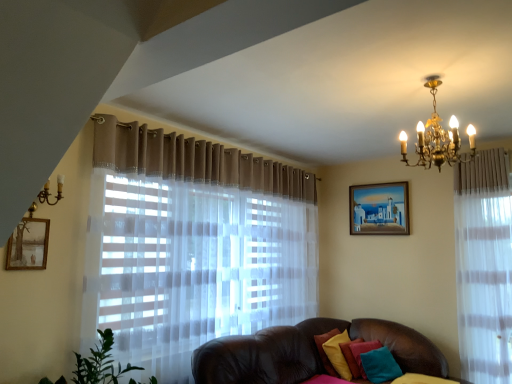
Looking at this image, what is the approximate width of sheer white curtain at left?

sheer white curtain at left is 30.31 inches wide.

Where is `sheer white curtain at left`? Image resolution: width=512 pixels, height=384 pixels. sheer white curtain at left is located at coordinates (192, 245).

The width and height of the screenshot is (512, 384). What do you see at coordinates (192, 245) in the screenshot?
I see `sheer white curtain at left` at bounding box center [192, 245].

The image size is (512, 384). In order to click on sheer white curtain at left in this screenshot , I will do `click(192, 245)`.